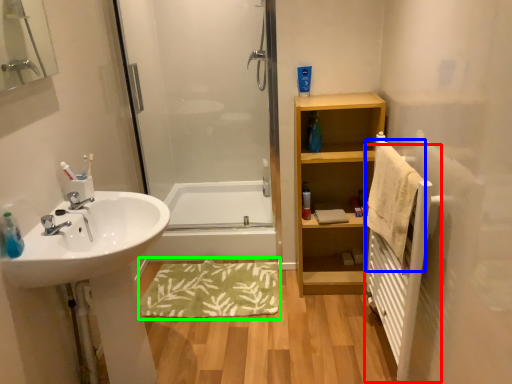
Question: Which is farther away from radiator (highlighted by a red box)? bath towel (highlighted by a blue box) or bath mat (highlighted by a green box)?

Choices:
 (A) bath towel
 (B) bath mat

Answer: (B)